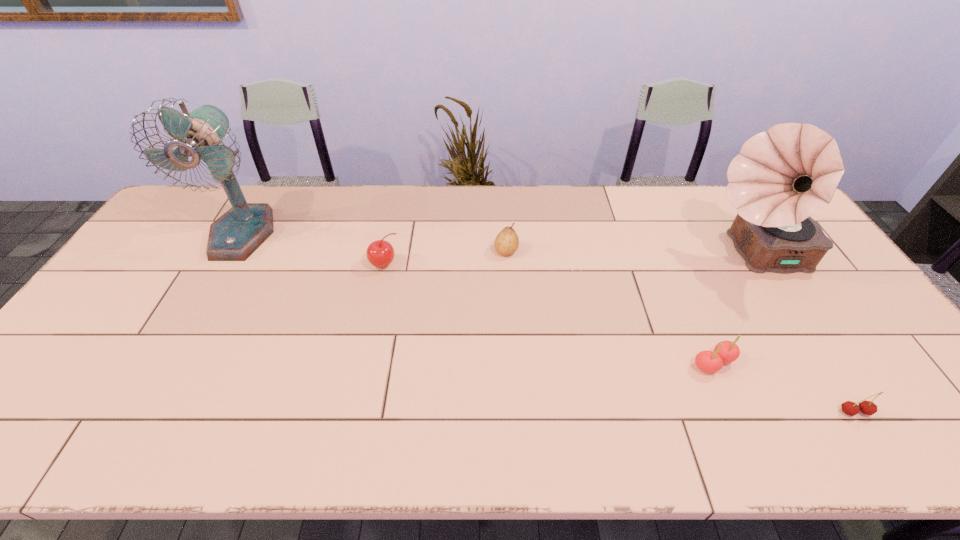
Locate an element on the screen. object that is at the left edge is located at coordinates (234, 236).

At what (x,y) coordinates should I click in order to perform the action: click on object that is positioned at the right edge. Please return your answer as a coordinate pair (x, y). This screenshot has height=540, width=960. Looking at the image, I should click on (781, 177).

The height and width of the screenshot is (540, 960). I want to click on object situated at the far left corner, so click(234, 236).

Where is `object positioned at the far right corner`? object positioned at the far right corner is located at coordinates (781, 177).

Locate an element on the screen. This screenshot has height=540, width=960. vacant space at the far edge is located at coordinates (709, 186).

Locate an element on the screen. This screenshot has width=960, height=540. vacant space at the near edge of the desktop is located at coordinates (713, 455).

Locate an element on the screen. free space at the left edge is located at coordinates (134, 275).

In the image, there is a desktop. At what (x,y) coordinates should I click in order to perform the action: click on vacant region at the right edge. Please return your answer as a coordinate pair (x, y). Looking at the image, I should click on (x=798, y=287).

Identify the location of vacant space at the far left corner. (179, 208).

The width and height of the screenshot is (960, 540). I want to click on unoccupied position between the fan and the nearest cherry, so click(x=548, y=323).